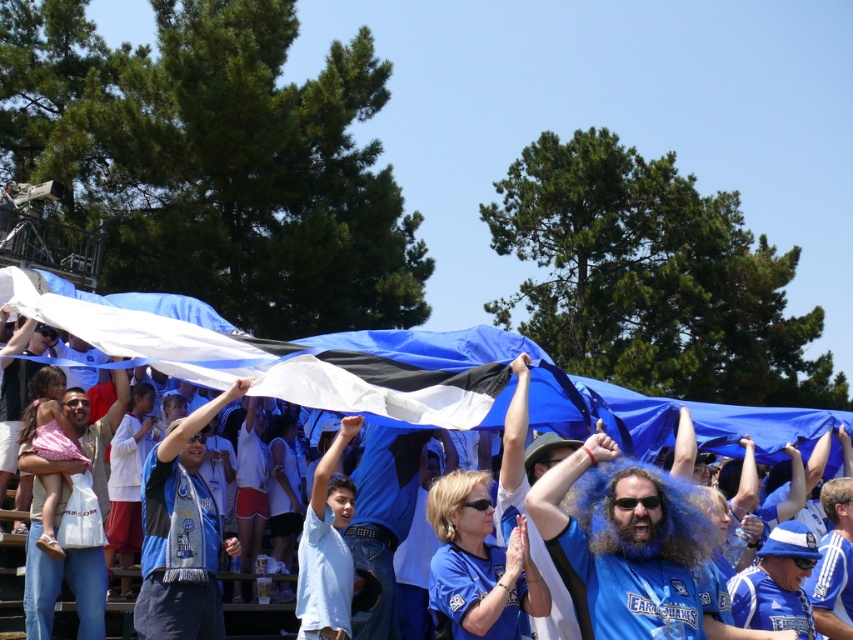
Question: Which object appears closest to the camera in this image?

Choices:
 (A) blue fabric wig at center
 (B) blue fabric flag at center

Answer: (A)

Question: Considering the relative positions of blue fabric flag at center and blue fabric wig at center in the image provided, where is blue fabric flag at center located with respect to blue fabric wig at center?

Choices:
 (A) above
 (B) below

Answer: (A)

Question: Among these points, which one is nearest to the camera?

Choices:
 (A) pos(631,557)
 (B) pos(434,356)

Answer: (A)

Question: Which point is farther from the camera taking this photo?

Choices:
 (A) (614, 636)
 (B) (204, 346)

Answer: (B)

Question: Is blue fabric flag at center behind blue fabric wig at center?

Choices:
 (A) no
 (B) yes

Answer: (B)

Question: Is blue fabric flag at center to the right of blue fabric wig at center from the viewer's perspective?

Choices:
 (A) no
 (B) yes

Answer: (A)